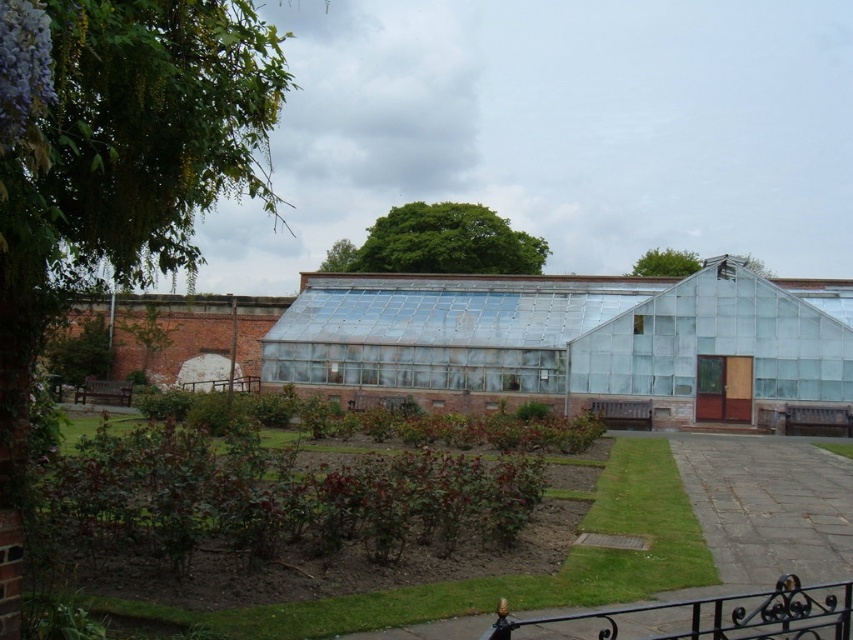
Does green leafy plants at center have a greater width compared to green leafy plant at center?

Yes.

Can you confirm if green leafy plants at center is positioned to the right of green leafy plant at center?

No, green leafy plants at center is not to the right of green leafy plant at center.

Does point (77, 508) come in front of point (834, 445)?

That is True.

Find the location of a particular element. green leafy plants at center is located at coordinates (335, 532).

Can you confirm if transparent glass conservatory at center is taller than green leafy plant at center?

Yes, transparent glass conservatory at center is taller than green leafy plant at center.

Which is above, transparent glass conservatory at center or green leafy plant at center?

transparent glass conservatory at center is above.

Describe the element at coordinates (572, 340) in the screenshot. I see `transparent glass conservatory at center` at that location.

Where is `transparent glass conservatory at center`? transparent glass conservatory at center is located at coordinates (572, 340).

Is green leafy plants at center shorter than transparent glass conservatory at center?

Indeed, green leafy plants at center has a lesser height compared to transparent glass conservatory at center.

Does green leafy plants at center appear on the right side of transparent glass conservatory at center?

Incorrect, green leafy plants at center is not on the right side of transparent glass conservatory at center.

Is point (201, 515) positioned before point (489, 401)?

Yes, it is.

The image size is (853, 640). What are the coordinates of `green leafy plants at center` in the screenshot? It's located at (335, 532).